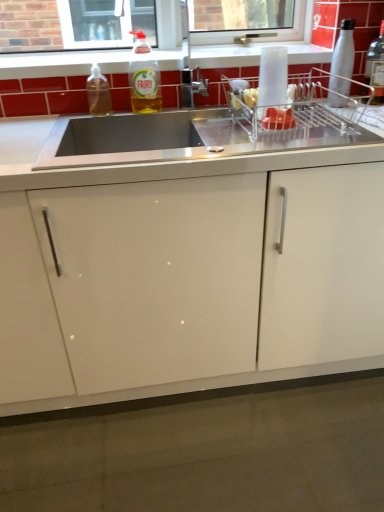
Question: Is there a large distance between translucent plastic bottle at upper center, marked as the 2th bottle in a left-to-right arrangement, and stainless steel sink at center?

Choices:
 (A) yes
 (B) no

Answer: (B)

Question: Does translucent plastic bottle at upper center, which is the 3th bottle from right to left, come in front of stainless steel sink at center?

Choices:
 (A) yes
 (B) no

Answer: (B)

Question: From the image's perspective, is translucent plastic bottle at upper center, marked as the 2th bottle in a left-to-right arrangement, over stainless steel sink at center?

Choices:
 (A) no
 (B) yes

Answer: (A)

Question: Does translucent plastic bottle at upper center, which is the 3th bottle from right to left, have a greater height compared to stainless steel sink at center?

Choices:
 (A) yes
 (B) no

Answer: (B)

Question: Can you confirm if translucent plastic bottle at upper center, which is the 3th bottle from right to left, is wider than stainless steel sink at center?

Choices:
 (A) no
 (B) yes

Answer: (B)

Question: From the image's perspective, is translucent plastic bottle at upper center, marked as the 2th bottle in a left-to-right arrangement, below stainless steel sink at center?

Choices:
 (A) no
 (B) yes

Answer: (B)

Question: Is silver metallic bottle at upper right, the second bottle from the right, bigger than translucent plastic bottle at upper center, which is the 3th bottle from right to left?

Choices:
 (A) yes
 (B) no

Answer: (B)

Question: From a real-world perspective, does silver metallic bottle at upper right, the second bottle from the right, sit lower than translucent plastic bottle at upper center, marked as the 2th bottle in a left-to-right arrangement?

Choices:
 (A) yes
 (B) no

Answer: (B)

Question: Is silver metallic bottle at upper right, the second bottle from the right, smaller than translucent plastic bottle at upper center, which is the 3th bottle from right to left?

Choices:
 (A) yes
 (B) no

Answer: (A)

Question: Would you say silver metallic bottle at upper right, the second bottle from the right, is outside translucent plastic bottle at upper center, marked as the 2th bottle in a left-to-right arrangement?

Choices:
 (A) no
 (B) yes

Answer: (B)

Question: Can you confirm if silver metallic bottle at upper right, the second bottle from the right, is taller than translucent plastic bottle at upper center, which is the 3th bottle from right to left?

Choices:
 (A) no
 (B) yes

Answer: (B)

Question: Is translucent plastic bottle at upper center, which is the 3th bottle from right to left, completely or partially inside silver metallic bottle at upper right, which is the third bottle in left-to-right order?

Choices:
 (A) no
 (B) yes

Answer: (A)

Question: From a real-world perspective, is clear glass bottle at upper right, acting as the 4th bottle starting from the left, beneath stainless steel sink at center?

Choices:
 (A) yes
 (B) no

Answer: (B)